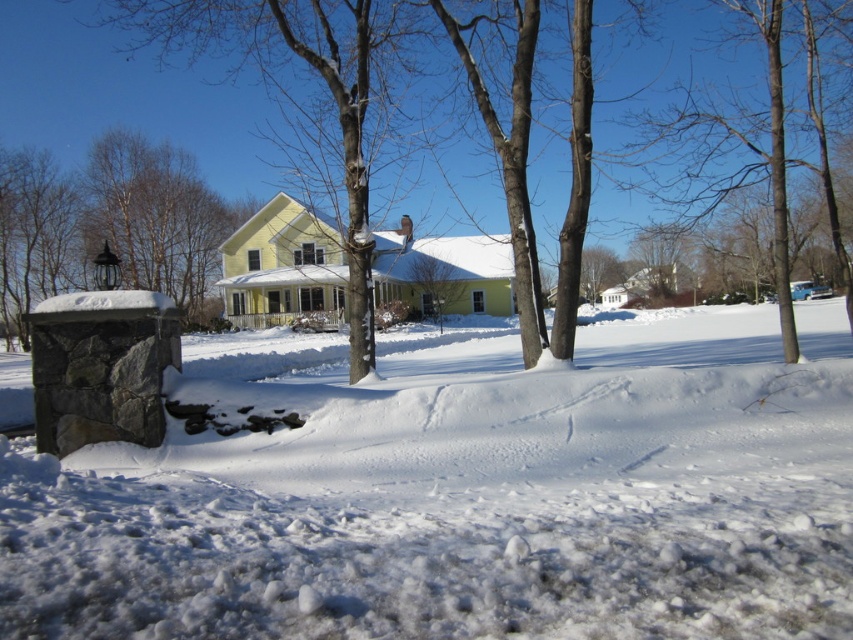
Question: Does white fluffy snow at lower center have a smaller size compared to smooth gray stone post at left?

Choices:
 (A) yes
 (B) no

Answer: (A)

Question: Which point is farther to the camera?

Choices:
 (A) brown smooth tree at center
 (B) white fluffy snow at lower center
 (C) smooth gray stone post at left

Answer: (C)

Question: Which point is farther to the camera?

Choices:
 (A) brown smooth tree at center
 (B) white fluffy snow at lower center
 (C) smooth gray stone post at left

Answer: (C)

Question: Does white fluffy snow at lower center come behind smooth gray stone post at left?

Choices:
 (A) yes
 (B) no

Answer: (B)

Question: Which of the following is the farthest from the observer?

Choices:
 (A) (631, 428)
 (B) (790, 337)

Answer: (B)

Question: In this image, where is white fluffy snow at lower center located relative to brown smooth tree at center?

Choices:
 (A) above
 (B) below

Answer: (B)